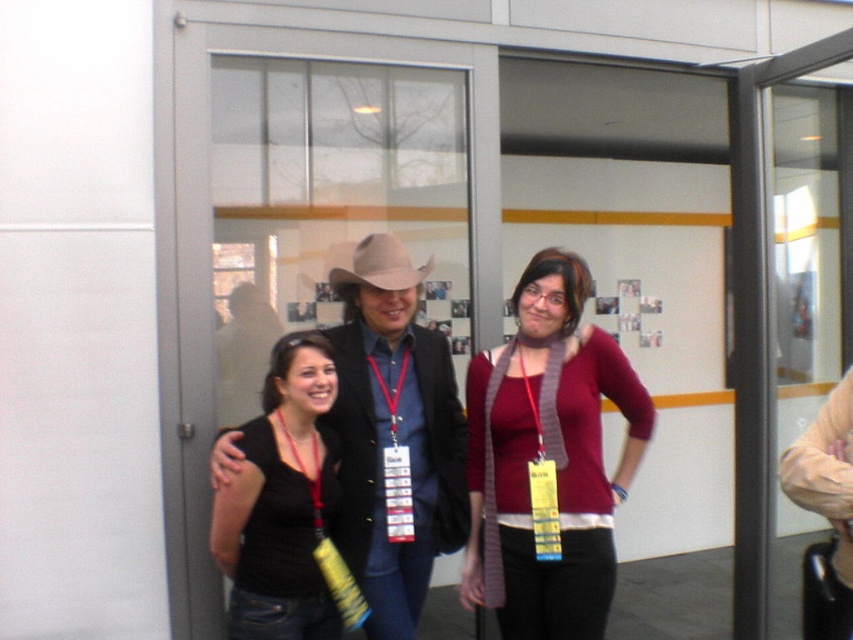
You are a photographer trying to capture a clear photo of the black matte shirt at center and the light brown felt cowboy hat at center. The camera you are using has a minimum focusing distance of 25 inches. Can you take a clear photo of both objects without moving the camera?

The black matte shirt at center is 25.75 inches from the light brown felt cowboy hat at center. Since the distance between them is greater than the camera minimum focusing distance of 25 inches, you can take a clear photo of both objects without moving the camera.